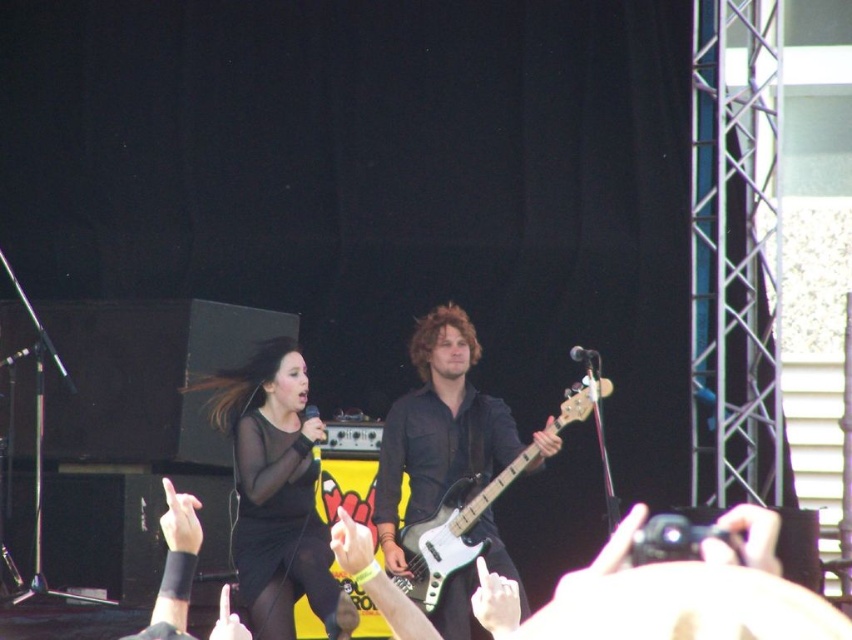
You are a photographer at the concert and want to capture a shot where both the black sheer dress at center and the metallic silver bass guitar at center are visible. Based on their positions, which one should you focus on first to ensure both are in frame?

The black sheer dress at center is located below the metallic silver bass guitar at center, so you should focus on the metallic silver bass guitar at center first to ensure both are in frame.

You are a photographer at the concert and want to capture both the black sheer dress at center and the metallic silver bass guitar at center in a single frame. Which object should you focus on first to ensure both are in focus?

Since the black sheer dress at center is larger than the metallic silver bass guitar at center, you should focus on the black sheer dress at center first to ensure both are in focus.